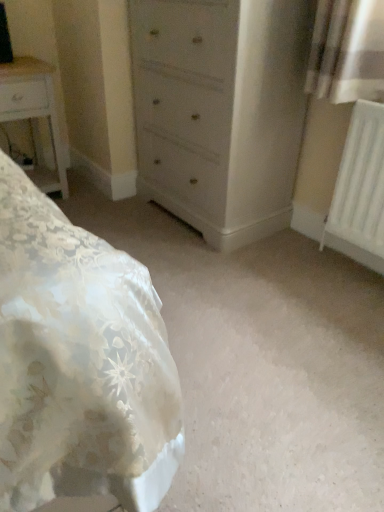
Find the location of a particular element. Image resolution: width=384 pixels, height=512 pixels. free location in front of white plastic radiator at right is located at coordinates (355, 297).